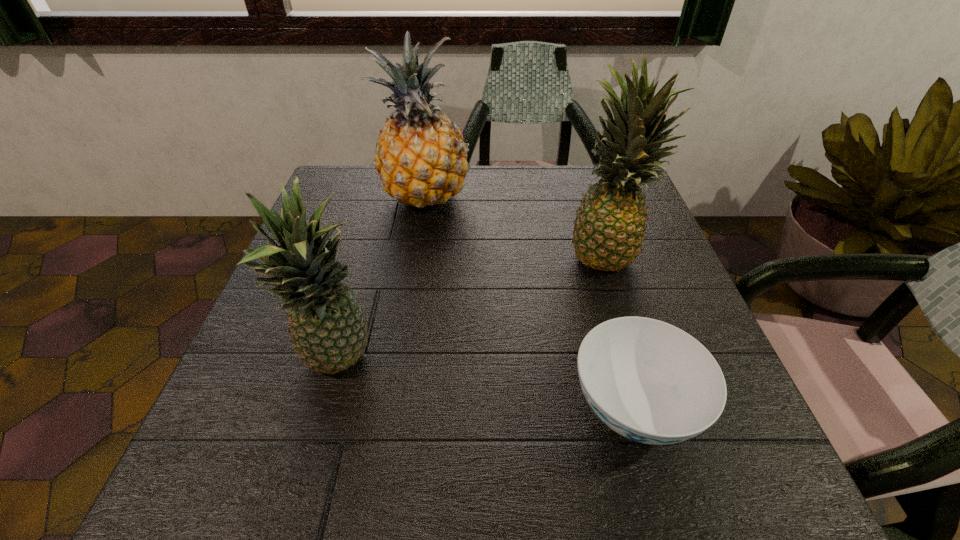
Where is `vacant space at the near left corner of the desktop`? This screenshot has width=960, height=540. vacant space at the near left corner of the desktop is located at coordinates (291, 484).

Locate an element on the screen. This screenshot has height=540, width=960. unoccupied area between the nearest pineapple and the farthest pineapple is located at coordinates (383, 281).

At what (x,y) coordinates should I click in order to perform the action: click on vacant space that's between the nearest pineapple and the chinaware. Please return your answer as a coordinate pair (x, y). The image size is (960, 540). Looking at the image, I should click on (487, 386).

The width and height of the screenshot is (960, 540). What are the coordinates of `unoccupied area between the nearest pineapple and the shortest object` in the screenshot? It's located at pos(487,386).

The width and height of the screenshot is (960, 540). In order to click on free point between the nearest pineapple and the second farthest object in this screenshot , I will do `click(473, 309)`.

Where is `vacant region between the farthest pineapple and the nearest pineapple`? The height and width of the screenshot is (540, 960). vacant region between the farthest pineapple and the nearest pineapple is located at coordinates (383, 281).

Where is `empty space between the second farthest object and the farthest pineapple`? empty space between the second farthest object and the farthest pineapple is located at coordinates (516, 227).

You are a GUI agent. You are given a task and a screenshot of the screen. Output one action in this format:
    pyautogui.click(x=<x>, y=<y>)
    Task: Click on the free space that is in between the chinaware and the farthest pineapple
    This screenshot has height=540, width=960.
    Given the screenshot: What is the action you would take?
    pyautogui.click(x=530, y=303)

Locate an element on the screen. This screenshot has height=540, width=960. empty space between the nearest pineapple and the farthest object is located at coordinates (383, 281).

The image size is (960, 540). What are the coordinates of `free space between the second farthest object and the farthest object` in the screenshot? It's located at (516, 227).